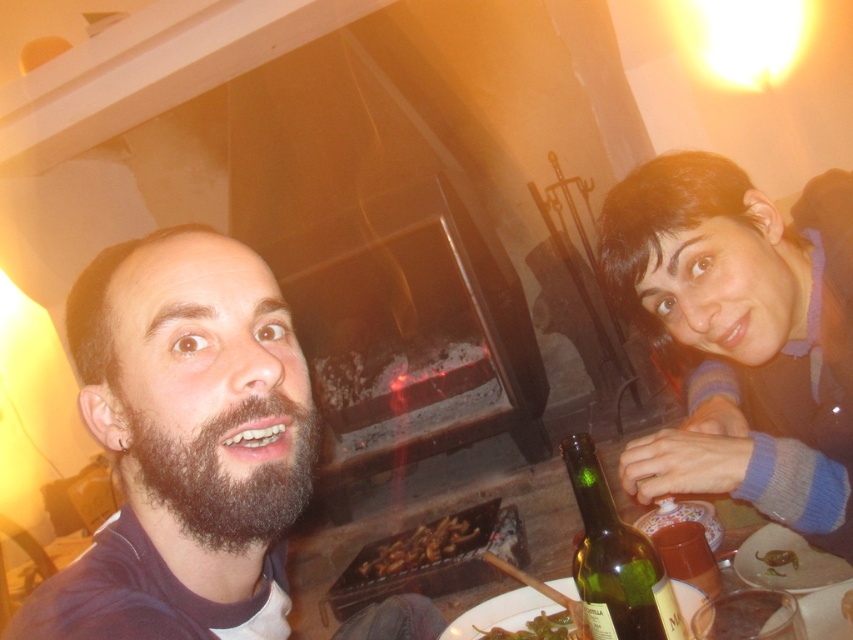
You are a waiter in a restaurant. You see the green glass bottle at lower right and the green leafy vegetable at lower center on the table. Which item is located to the right of the other?

The green glass bottle at lower right is positioned on the right side of green leafy vegetable at lower center, so the green glass bottle at lower right is to the right of the green leafy vegetable at lower center.

In the scene shown: You are a waiter in a restaurant. You need to serve a customer who is sitting between the dark brown beard at center and the shiny brown meat at lower right. Which object is closer to the customer?

The dark brown beard at center is closer to the customer since it has a larger size compared to the shiny brown meat at lower right.

You are a waiter in a restaurant. You see the green glass bottle at lower right and the brown crispy bread at center on the table. Which item is closer to the customer sitting on the right side of the table?

The green glass bottle at lower right is closer to the customer sitting on the right side of the table because it is positioned in front of the brown crispy bread at center, which would place it nearer to that customer.